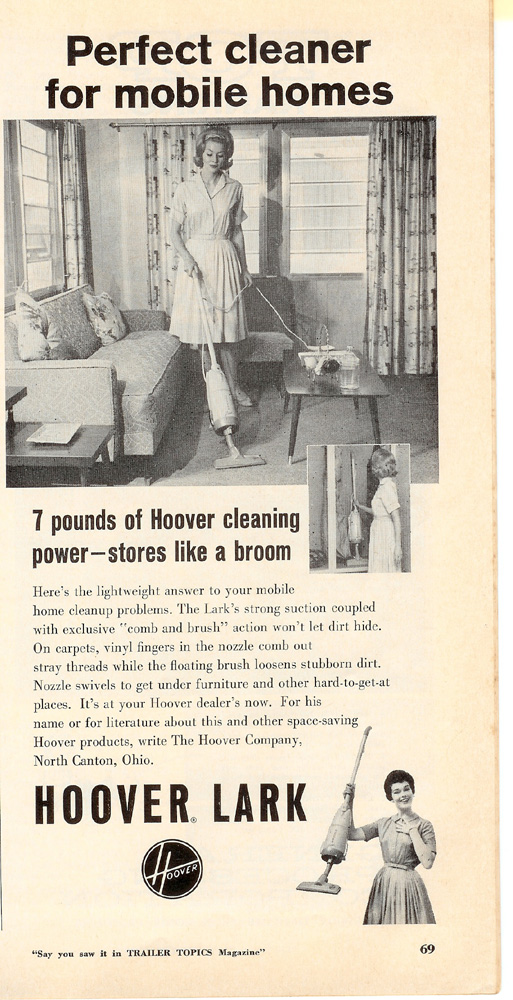
Where is `curtain rod`? The width and height of the screenshot is (513, 1000). curtain rod is located at coordinates (125, 124), (280, 120).